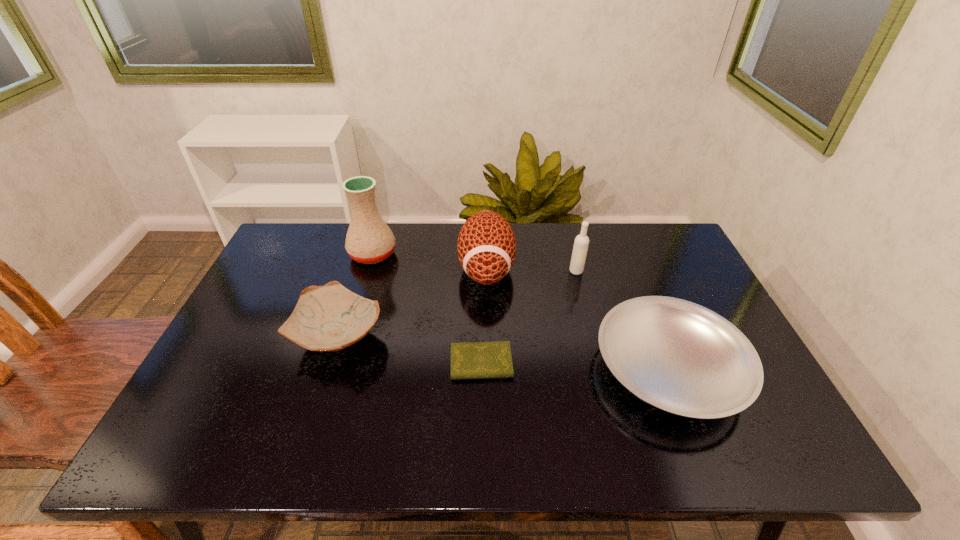
In the image, there is a desktop. What are the coordinates of `vacant space at the far edge` in the screenshot? It's located at (631, 262).

Where is `vacant space at the near edge of the desktop`? This screenshot has height=540, width=960. vacant space at the near edge of the desktop is located at coordinates (287, 438).

This screenshot has width=960, height=540. Find the location of `vacant space at the right edge of the desktop`. vacant space at the right edge of the desktop is located at coordinates (754, 414).

In the image, there is a desktop. Where is `vacant space at the far left corner`? The image size is (960, 540). vacant space at the far left corner is located at coordinates (300, 262).

Locate an element on the screen. vacant space at the far right corner of the desktop is located at coordinates (678, 261).

Locate an element on the screen. The width and height of the screenshot is (960, 540). free space that is in between the diary and the shorter pottery is located at coordinates (410, 349).

Locate an element on the screen. The image size is (960, 540). empty location between the vodka and the diary is located at coordinates (529, 317).

This screenshot has height=540, width=960. Identify the location of free space between the football and the shorter pottery. (413, 302).

The image size is (960, 540). Identify the location of empty space between the fourth tallest object and the vodka. (458, 303).

This screenshot has width=960, height=540. I want to click on free space between the football and the diary, so [484, 316].